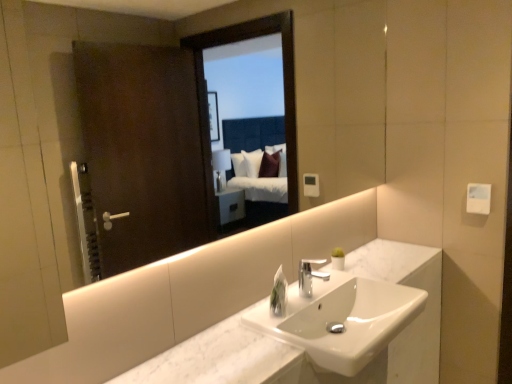
The image size is (512, 384). In order to click on unoccupied area behind silver metallic faucet at center in this screenshot , I will do `click(313, 281)`.